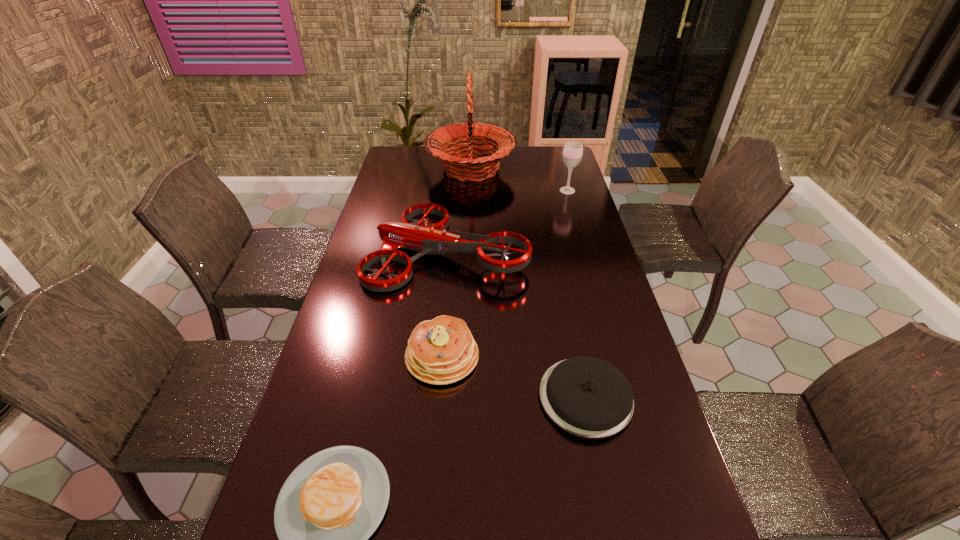
Identify which pancake is the second nearest to the tallest object. Please provide its 2D coordinates. Your answer should be formatted as a tuple, i.e. [(x, y)], where the tuple contains the x and y coordinates of a point satisfying the conditions above.

[(587, 397)]

You are a GUI agent. You are given a task and a screenshot of the screen. Output one action in this format:
    pyautogui.click(x=<x>, y=<y>)
    Task: Click on the free space that satisfies the following two spatial constraints: 1. on the front side of the tallest pancake; 2. on the left side of the rightmost pancake
    Image resolution: width=960 pixels, height=540 pixels.
    Given the screenshot: What is the action you would take?
    pyautogui.click(x=439, y=397)

Find the location of a particular element. blank space that satisfies the following two spatial constraints: 1. on the back side of the wineglass; 2. on the left side of the third farthest object is located at coordinates (453, 191).

You are a GUI agent. You are given a task and a screenshot of the screen. Output one action in this format:
    pyautogui.click(x=<x>, y=<y>)
    Task: Click on the vacant space that satisfies the following two spatial constraints: 1. on the back side of the tallest pancake; 2. on the right side of the wineglass
    
    Given the screenshot: What is the action you would take?
    pyautogui.click(x=456, y=191)